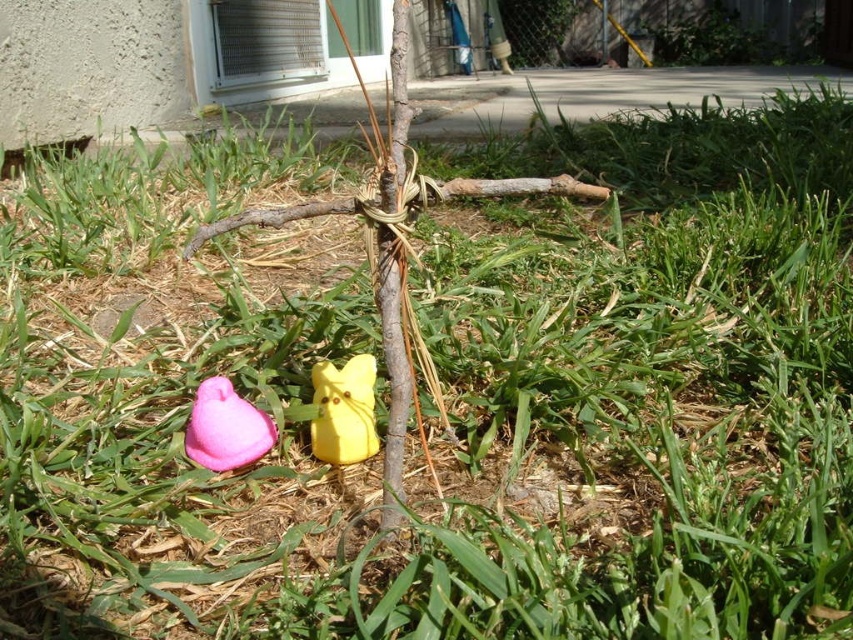
You are standing at the origin point of the coordinate system in the image. You want to place a new decoration exactly 0.1 units to the right of the yellow matte plush at center. What are the coordinates of the new position?

The new position would be at coordinates (344,474).

You are a gardener who wants to place a new decoration between the yellow matte plush at center and the matte pink peep at lower left. Based on their positions, where should you place the decoration so it is exactly in the middle between them?

The yellow matte plush at center is to the right of the matte pink peep at lower left, so placing the decoration halfway between them would mean positioning it between the two objects along the horizontal axis, closer to the center of the two positions.

You are a gardener who wants to place a new decoration between the yellow matte plush at center and the matte pink peep at lower left. The decoration requires at least 2 inches of space between it and any existing objects. Can you fit it there?

The yellow matte plush at center is taller than the matte pink peep at lower left. Since the space between them isn